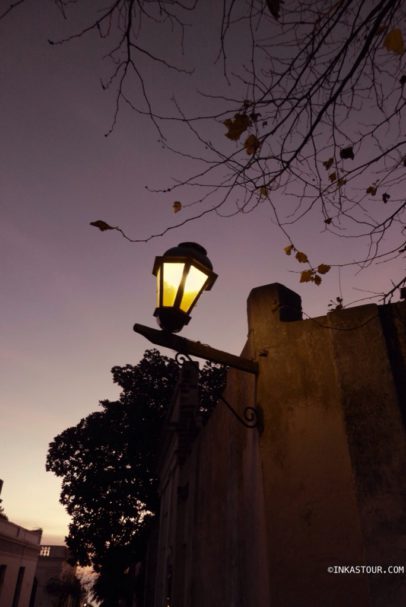
Locate an element on the screen. Image resolution: width=406 pixels, height=607 pixels. lamp plinth is located at coordinates (176, 342).